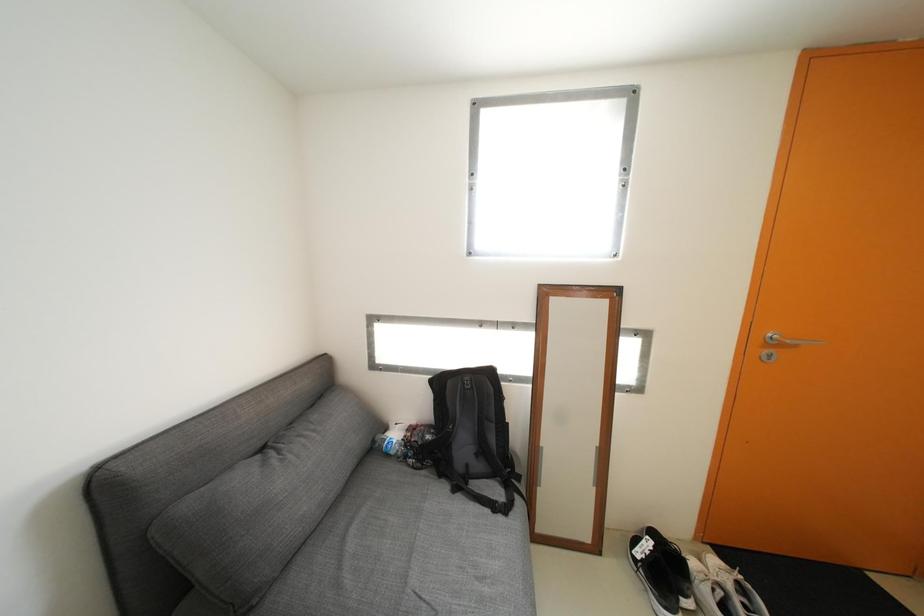
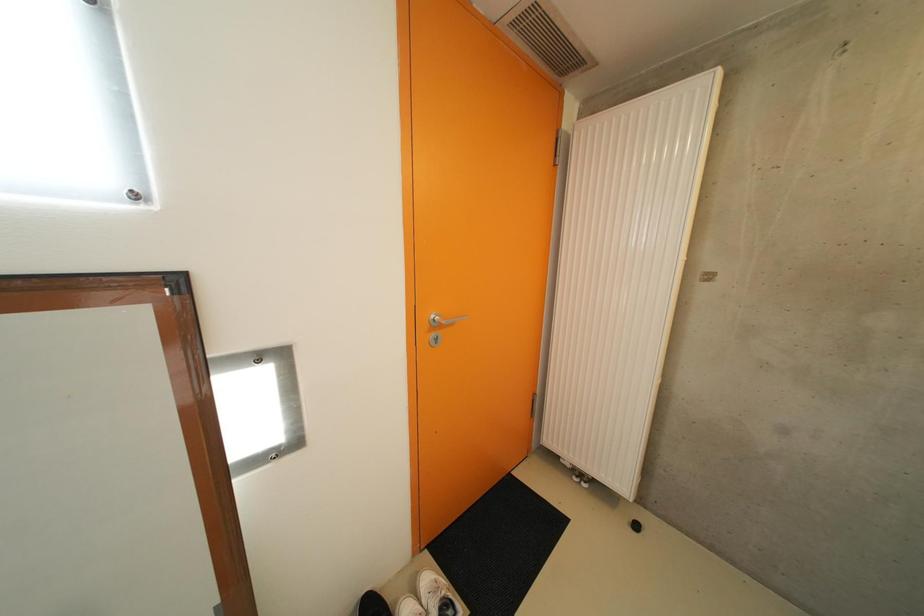
Question: The images are taken continuously from a first-person perspective. In which direction is your viewpoint rotating?

Choices:
 (A) Left
 (B) Right
 (C) Up
 (D) Down

Answer: (B)